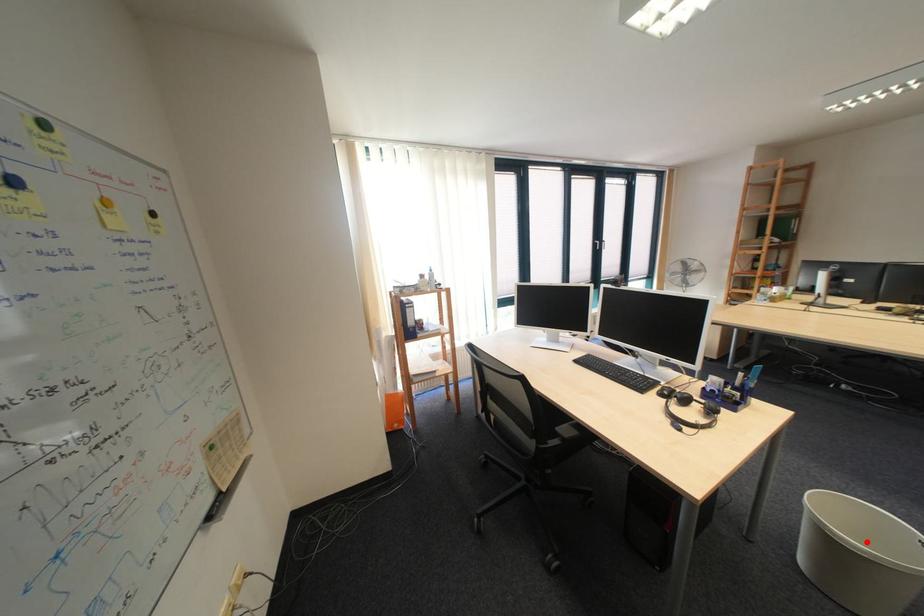
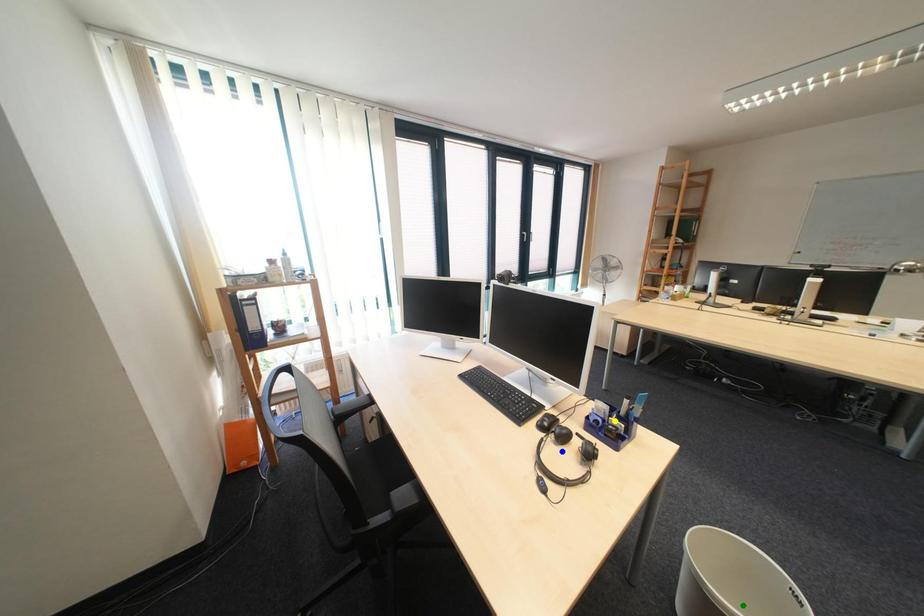
Question: I am providing you with two images of the same scene from different viewpoints. A red point is marked on the first image. You are given multiple points on the second image. Can you choose the point in image 2 that corresponds to the point in image 1?

Choices:
 (A) yellow point
 (B) green point
 (C) blue point

Answer: (B)